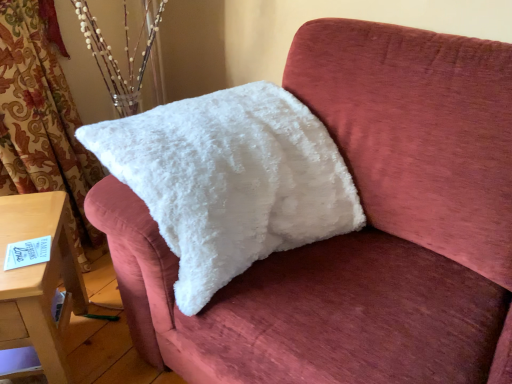
Describe the element at coordinates (39, 281) in the screenshot. Image resolution: width=512 pixels, height=384 pixels. I see `wooden table at lower left` at that location.

You are a GUI agent. You are given a task and a screenshot of the screen. Output one action in this format:
    pyautogui.click(x=<x>, y=<y>)
    Task: Click on the wooden table at lower left
    The width and height of the screenshot is (512, 384).
    Given the screenshot: What is the action you would take?
    pyautogui.click(x=39, y=281)

In order to face white fluffy pillow at upper left, should I rotate leftwards or rightwards?

You should rotate left by 3.103 degrees.

The width and height of the screenshot is (512, 384). Describe the element at coordinates (230, 180) in the screenshot. I see `white fluffy pillow at upper left` at that location.

This screenshot has width=512, height=384. Find the location of `white fluffy pillow at upper left`. white fluffy pillow at upper left is located at coordinates (230, 180).

The height and width of the screenshot is (384, 512). In order to click on wooden table at lower left in this screenshot , I will do `click(39, 281)`.

Does wooden table at lower left appear on the left side of white fluffy pillow at upper left?

Yes, wooden table at lower left is to the left of white fluffy pillow at upper left.

Is the position of wooden table at lower left more distant than that of white fluffy pillow at upper left?

Yes, wooden table at lower left is further from the camera.

Is point (69, 273) behind point (177, 145)?

That is True.

From the picture: From the image's perspective, between wooden table at lower left and white fluffy pillow at upper left, which one is located above?

white fluffy pillow at upper left.

From a real-world perspective, between wooden table at lower left and white fluffy pillow at upper left, who is vertically lower?

wooden table at lower left.

Between wooden table at lower left and white fluffy pillow at upper left, which one has larger width?

white fluffy pillow at upper left.

Is wooden table at lower left taller or shorter than white fluffy pillow at upper left?

Clearly, wooden table at lower left is shorter compared to white fluffy pillow at upper left.

Considering the sizes of objects wooden table at lower left and white fluffy pillow at upper left in the image provided, who is smaller, wooden table at lower left or white fluffy pillow at upper left?

wooden table at lower left.

Is wooden table at lower left located outside white fluffy pillow at upper left?

That's correct, wooden table at lower left is outside of white fluffy pillow at upper left.

Is wooden table at lower left not near white fluffy pillow at upper left?

wooden table at lower left is actually quite close to white fluffy pillow at upper left.

Could you tell me if wooden table at lower left is turned towards white fluffy pillow at upper left?

No, wooden table at lower left is not facing towards white fluffy pillow at upper left.

How different are the orientations of wooden table at lower left and white fluffy pillow at upper left in degrees?

wooden table at lower left and white fluffy pillow at upper left are facing 29.4 degrees away from each other.

At what (x,y) coordinates should I click in order to perform the action: click on pillow that appears in front of the wooden table at lower left. Please return your answer as a coordinate pair (x, y). Image resolution: width=512 pixels, height=384 pixels. Looking at the image, I should click on (230, 180).

Considering the positions of objects white fluffy pillow at upper left and wooden table at lower left in the image provided, who is more to the right, white fluffy pillow at upper left or wooden table at lower left?

From the viewer's perspective, white fluffy pillow at upper left appears more on the right side.

Is white fluffy pillow at upper left positioned in front of wooden table at lower left?

Yes, it is in front of wooden table at lower left.

Is point (141, 141) positioned behind point (11, 292)?

Yes.

From the image's perspective, relative to wooden table at lower left, is white fluffy pillow at upper left above or below?

white fluffy pillow at upper left is above wooden table at lower left.

From a real-world perspective, which is physically above, white fluffy pillow at upper left or wooden table at lower left?

white fluffy pillow at upper left is physically above.

Can you confirm if white fluffy pillow at upper left is wider than wooden table at lower left?

Indeed, white fluffy pillow at upper left has a greater width compared to wooden table at lower left.

Between white fluffy pillow at upper left and wooden table at lower left, which one has less height?

wooden table at lower left.

Consider the image. In terms of size, does white fluffy pillow at upper left appear bigger or smaller than wooden table at lower left?

Clearly, white fluffy pillow at upper left is larger in size than wooden table at lower left.

Is wooden table at lower left completely or partially inside white fluffy pillow at upper left?

Definitely not — wooden table at lower left is not inside white fluffy pillow at upper left.

Is white fluffy pillow at upper left with wooden table at lower left?

white fluffy pillow at upper left and wooden table at lower left are clearly separated.

Is white fluffy pillow at upper left looking in the opposite direction of wooden table at lower left?

No, wooden table at lower left is not at the back of white fluffy pillow at upper left.

Identify the location of pillow above the wooden table at lower left (from the image's perspective). This screenshot has height=384, width=512. (230, 180).

Locate an element on the screen. The width and height of the screenshot is (512, 384). furniture to the left of white fluffy pillow at upper left is located at coordinates (39, 281).

Image resolution: width=512 pixels, height=384 pixels. Find the location of `furniture located behind the white fluffy pillow at upper left`. furniture located behind the white fluffy pillow at upper left is located at coordinates (39, 281).